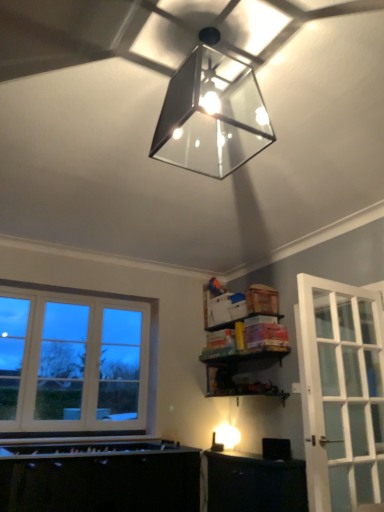
Question: Is black plastic speaker at lower right a part of matte glass lampshade at upper center?

Choices:
 (A) yes
 (B) no

Answer: (B)

Question: Is matte glass lampshade at upper center at the right side of black plastic speaker at lower right?

Choices:
 (A) no
 (B) yes

Answer: (A)

Question: Is matte glass lampshade at upper center far away from black plastic speaker at lower right?

Choices:
 (A) yes
 (B) no

Answer: (A)

Question: Can you confirm if matte glass lampshade at upper center is taller than black plastic speaker at lower right?

Choices:
 (A) yes
 (B) no

Answer: (A)

Question: Is matte glass lampshade at upper center positioned with its back to black plastic speaker at lower right?

Choices:
 (A) yes
 (B) no

Answer: (B)

Question: From a real-world perspective, is matte glass lampshade at upper center physically below black plastic speaker at lower right?

Choices:
 (A) yes
 (B) no

Answer: (B)

Question: Can you confirm if black plastic speaker at lower right is shorter than matte glass lampshade at upper center?

Choices:
 (A) yes
 (B) no

Answer: (A)

Question: Is black plastic speaker at lower right with matte glass lampshade at upper center?

Choices:
 (A) yes
 (B) no

Answer: (B)

Question: Would you say matte glass lampshade at upper center is part of black plastic speaker at lower right's contents?

Choices:
 (A) no
 (B) yes

Answer: (A)

Question: From the image's perspective, is black plastic speaker at lower right over matte glass lampshade at upper center?

Choices:
 (A) yes
 (B) no

Answer: (B)

Question: Does black plastic speaker at lower right have a larger size compared to matte glass lampshade at upper center?

Choices:
 (A) yes
 (B) no

Answer: (B)

Question: Could you tell me if black plastic speaker at lower right is turned towards matte glass lampshade at upper center?

Choices:
 (A) yes
 (B) no

Answer: (B)

Question: Does point (271, 458) appear closer or farther from the camera than point (193, 60)?

Choices:
 (A) farther
 (B) closer

Answer: (A)